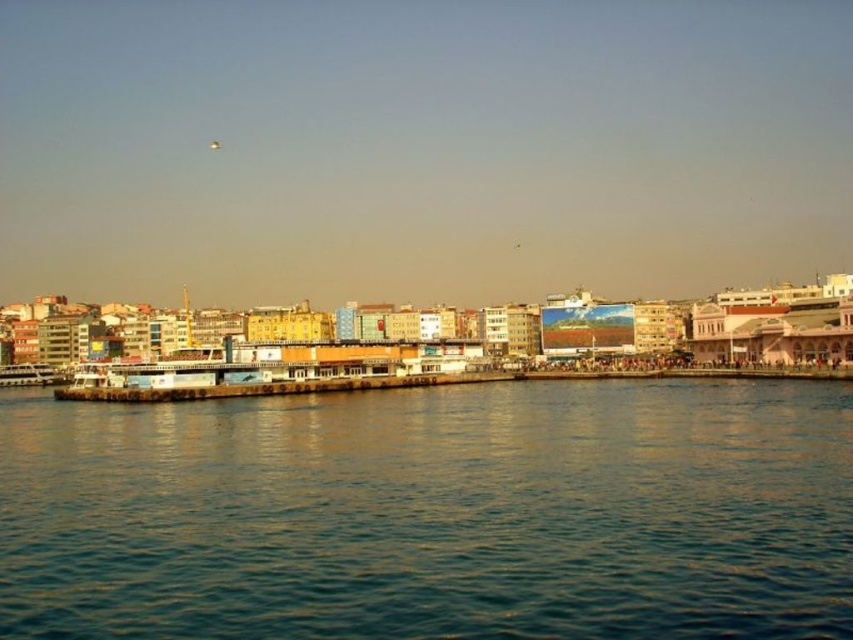
Question: Which object is farther from the camera taking this photo?

Choices:
 (A) white matte boat at lower left
 (B) blue water at lower center

Answer: (A)

Question: Which of the following is the closest to the observer?

Choices:
 (A) (720, 620)
 (B) (64, 381)

Answer: (A)

Question: Can you confirm if blue water at lower center is positioned above white matte boat at lower left?

Choices:
 (A) no
 (B) yes

Answer: (A)

Question: Is blue water at lower center smaller than white matte boat at lower left?

Choices:
 (A) no
 (B) yes

Answer: (A)

Question: Is blue water at lower center further to the viewer compared to white matte boat at lower left?

Choices:
 (A) no
 (B) yes

Answer: (A)